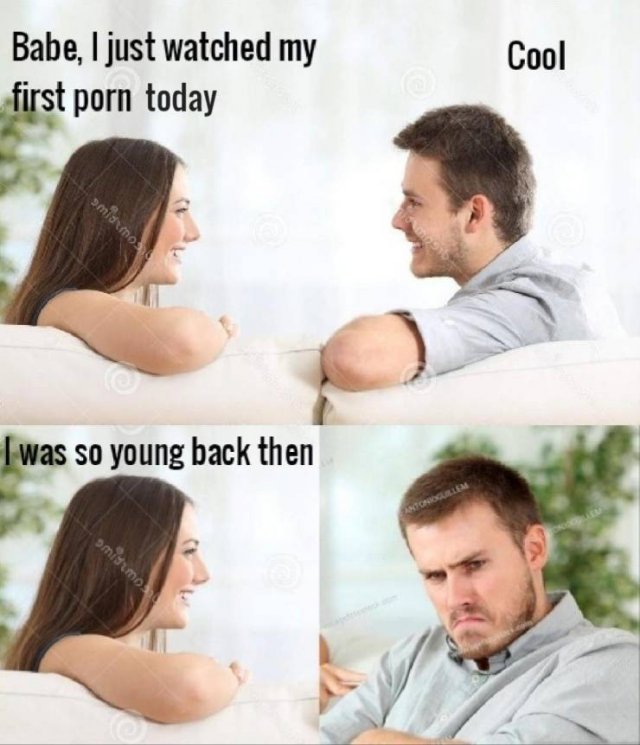
Where is `3 plants`? Image resolution: width=640 pixels, height=745 pixels. 3 plants is located at coordinates (577, 489), (20, 504), (19, 155).